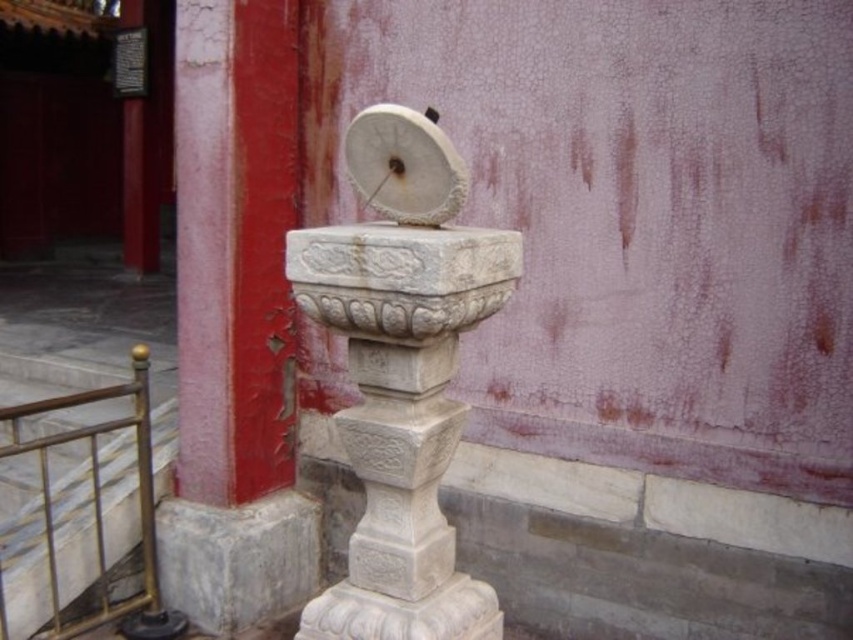
Question: Where is white stone sundial at center located in relation to brushed metal railing at lower left in the image?

Choices:
 (A) above
 (B) below

Answer: (A)

Question: Is white stone sundial at center to the left of brushed metal railing at lower left from the viewer's perspective?

Choices:
 (A) yes
 (B) no

Answer: (B)

Question: Which of the following is the closest to the observer?

Choices:
 (A) (143, 486)
 (B) (396, 467)

Answer: (B)

Question: Observing the image, what is the correct spatial positioning of white stone sundial at center in reference to brushed metal railing at lower left?

Choices:
 (A) left
 (B) right

Answer: (B)

Question: Which of the following is the farthest from the observer?

Choices:
 (A) white stone sundial at center
 (B) brushed metal railing at lower left

Answer: (B)